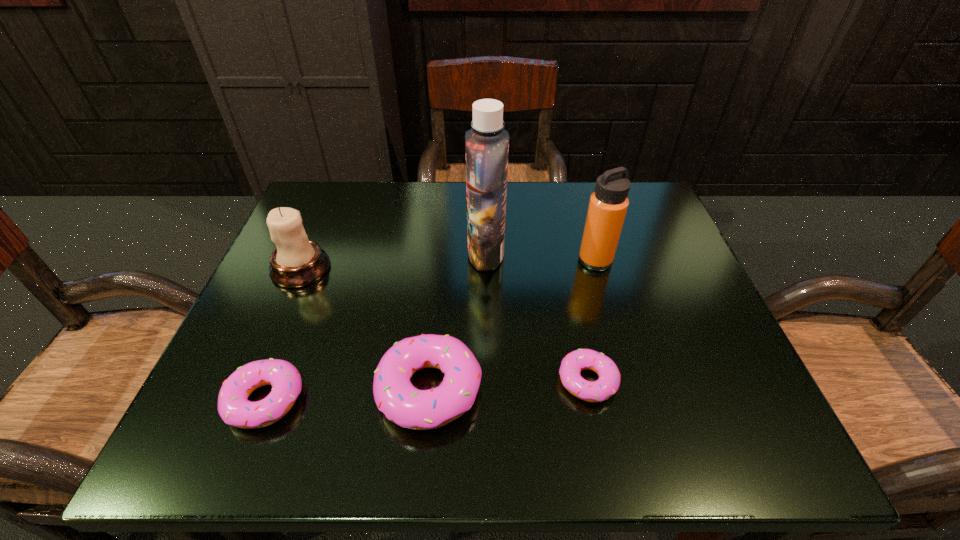
At what (x,y) coordinates should I click in order to perform the action: click on the second shortest object. Please return your answer as a coordinate pair (x, y). Looking at the image, I should click on (235, 409).

Locate an element on the screen. The image size is (960, 540). the second tallest doughnut is located at coordinates (235, 409).

Where is `the third shortest object`? the third shortest object is located at coordinates (394, 394).

Identify the location of the second doughnut from left to right. (394, 394).

The width and height of the screenshot is (960, 540). Identify the location of the rightmost doughnut. (608, 383).

Locate an element on the screen. This screenshot has height=540, width=960. the shortest object is located at coordinates pos(608,383).

You are a GUI agent. You are given a task and a screenshot of the screen. Output one action in this format:
    pyautogui.click(x=<x>, y=<y>)
    Task: Click on the fourth shortest object
    The image size is (960, 540).
    Given the screenshot: What is the action you would take?
    pyautogui.click(x=297, y=261)

The image size is (960, 540). In order to click on shampoo in this screenshot , I will do `click(487, 143)`.

Identify the location of the fifth shortest object. (608, 205).

You are a GUI agent. You are given a task and a screenshot of the screen. Output one action in this format:
    pyautogui.click(x=<x>, y=<y>)
    Task: Click on the vacant region located 0.080m on the back of the leftmost doughnut
    
    Given the screenshot: What is the action you would take?
    pyautogui.click(x=292, y=332)